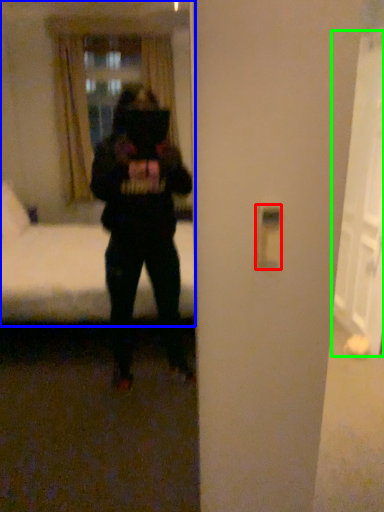
Question: Which is farther away from light switch (highlighted by a red box)? mirror (highlighted by a blue box) or glass door (highlighted by a green box)?

Choices:
 (A) mirror
 (B) glass door

Answer: (A)